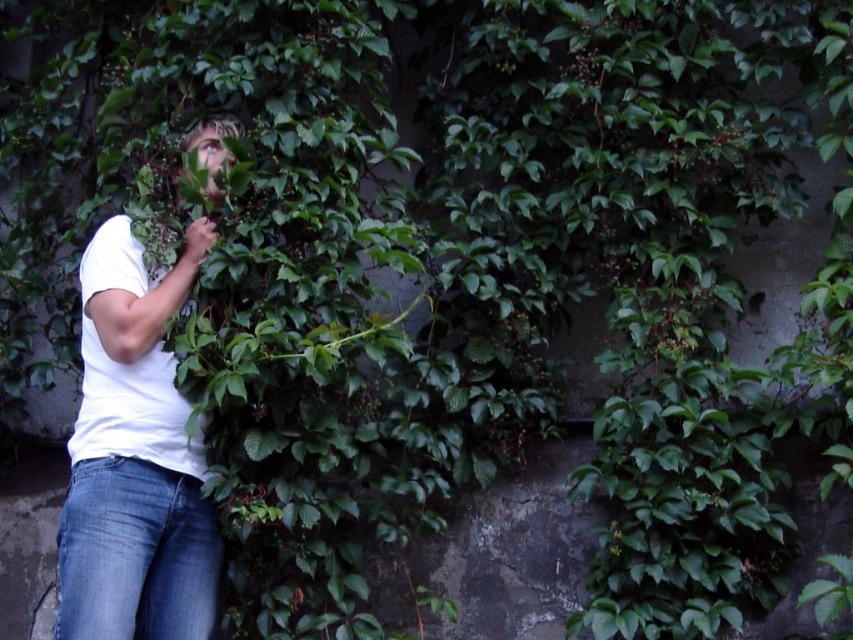
You are a photographer trying to capture the person in the image. The point at coordinate (x=134, y=458) is on the white cotton shirt at left. Where should you focus your camera to ensure the person is in sharp focus?

You should focus your camera on the white cotton shirt at left where the point (x=134, y=458) is located, as this area is part of the person and ensuring sharpness here will help keep the entire subject in focus.

Consider the image. You are an architect designing a new garden wall. You have two points marked on the wall where you want to install lights. The points are labeled as point 1 at coordinates point (161, 634) and point 2 at coordinates point (62, 596). Based on the image provided, which point is closer to the viewer and thus would be better for a light that needs to be more prominent?

Point (161, 634) is further to the viewer than point (62, 596). Therefore, point (62, 596) is closer to the viewer and would be better for a light that needs to be more prominent.